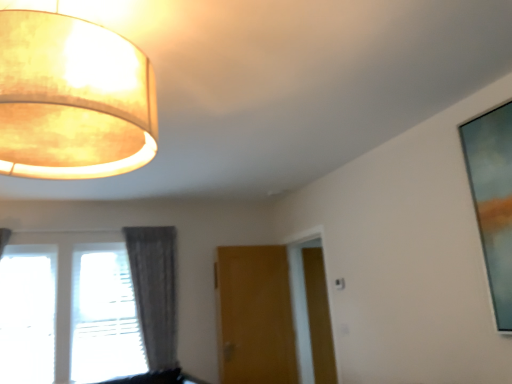
Question: Is matte beige lampshade at upper left at the back of brown wood screen door at center?

Choices:
 (A) yes
 (B) no

Answer: (B)

Question: Is brown wood screen door at center shorter than matte beige lampshade at upper left?

Choices:
 (A) yes
 (B) no

Answer: (B)

Question: Is brown wood screen door at center to the left of matte beige lampshade at upper left from the viewer's perspective?

Choices:
 (A) no
 (B) yes

Answer: (A)

Question: Is the position of brown wood screen door at center less distant than that of matte beige lampshade at upper left?

Choices:
 (A) yes
 (B) no

Answer: (B)

Question: Can you confirm if brown wood screen door at center is positioned to the right of matte beige lampshade at upper left?

Choices:
 (A) yes
 (B) no

Answer: (A)

Question: From the image's perspective, is brown wood screen door at center under matte beige lampshade at upper left?

Choices:
 (A) yes
 (B) no

Answer: (A)

Question: From a real-world perspective, is matte beige lampshade at upper left physically below wooden door at center?

Choices:
 (A) yes
 (B) no

Answer: (B)

Question: Would you say matte beige lampshade at upper left is outside wooden door at center?

Choices:
 (A) yes
 (B) no

Answer: (A)

Question: Does matte beige lampshade at upper left have a greater width compared to wooden door at center?

Choices:
 (A) yes
 (B) no

Answer: (A)

Question: Is wooden door at center surrounded by matte beige lampshade at upper left?

Choices:
 (A) no
 (B) yes

Answer: (A)

Question: Can you confirm if matte beige lampshade at upper left is shorter than wooden door at center?

Choices:
 (A) yes
 (B) no

Answer: (A)

Question: From the image's perspective, is matte beige lampshade at upper left beneath wooden door at center?

Choices:
 (A) no
 (B) yes

Answer: (A)

Question: Does brown wood screen door at center have a lesser width compared to transparent glass window at lower left?

Choices:
 (A) no
 (B) yes

Answer: (B)